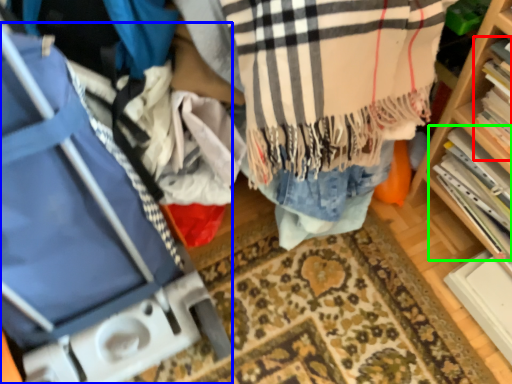
Question: Which object is the closest to the book (highlighted by a red box)? Choose among these: luggage (highlighted by a blue box) or book (highlighted by a green box).

Choices:
 (A) luggage
 (B) book

Answer: (B)